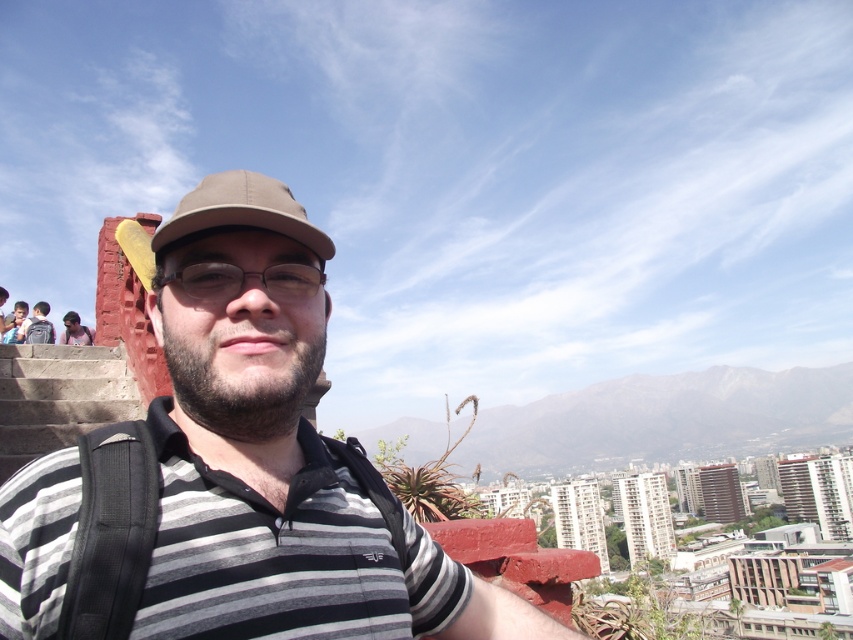
Question: Is matte brown baseball cap at center behind matte black backpack at lower left?

Choices:
 (A) no
 (B) yes

Answer: (A)

Question: Which point is farther to the camera?

Choices:
 (A) matte black backpack at left
 (B) striped cotton shirt at center

Answer: (A)

Question: Is striped cotton shirt at center below matte black backpack at lower left?

Choices:
 (A) yes
 (B) no

Answer: (A)

Question: Among these points, which one is nearest to the camera?

Choices:
 (A) (16, 310)
 (B) (277, 182)

Answer: (B)

Question: Is the position of clear plastic glasses at center less distant than that of striped cotton shirt at lower left?

Choices:
 (A) no
 (B) yes

Answer: (B)

Question: Which of the following is the farthest from the observer?

Choices:
 (A) (80, 326)
 (B) (26, 307)
 (C) (267, 573)
 (D) (167, 234)

Answer: (B)